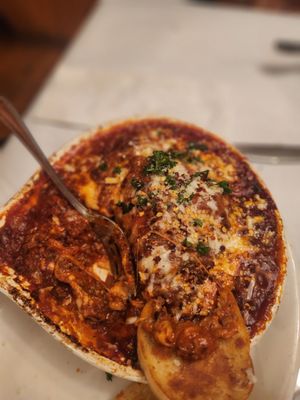
Image resolution: width=300 pixels, height=400 pixels. In order to click on floor in this screenshot , I will do `click(29, 62)`.